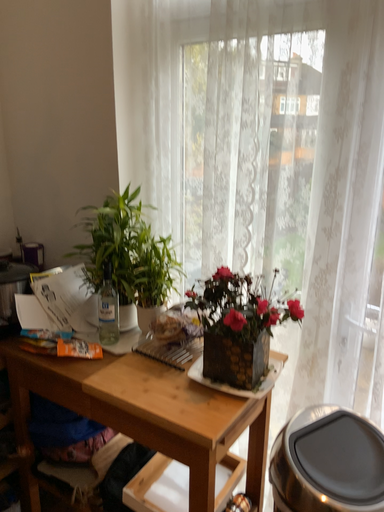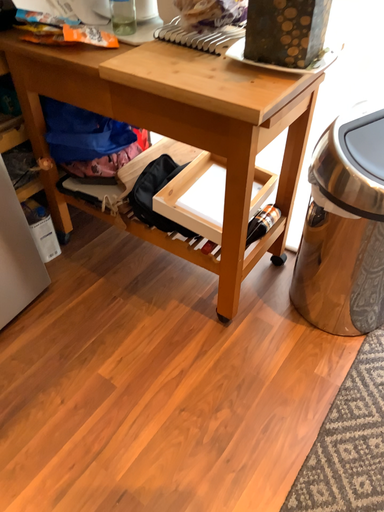
Question: Which way did the camera rotate in the video?

Choices:
 (A) rotated downward
 (B) rotated upward

Answer: (A)